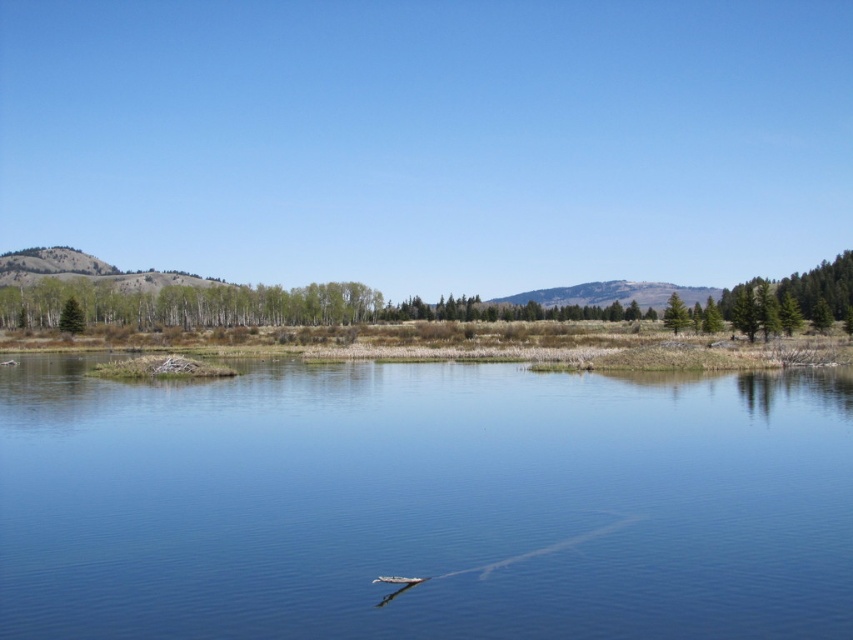
You are standing at the edge of the water in the serene landscape scene. You notice two points marked in the image. Which point, point (253,605) or point (682,301), is closer to your current position?

Point (253,605) is closer to the camera than point (682,301), so it is closer to your current position.

You are standing at the edge of the water in the serene natural landscape. You see two points marked on the image, point (679, 634) and point (820, 282). Which point is nearer to your current position?

Point (679, 634) is closer to the camera than point (820, 282), so the point (679, 634) is nearer to your current position.

You are standing at the edge of the water and want to locate the clear water at center. According to the coordinates provided, in which direction should you look relative to your position?

The clear water at center is located at coordinates point (422, 504), so you should look towards the center of the water body.